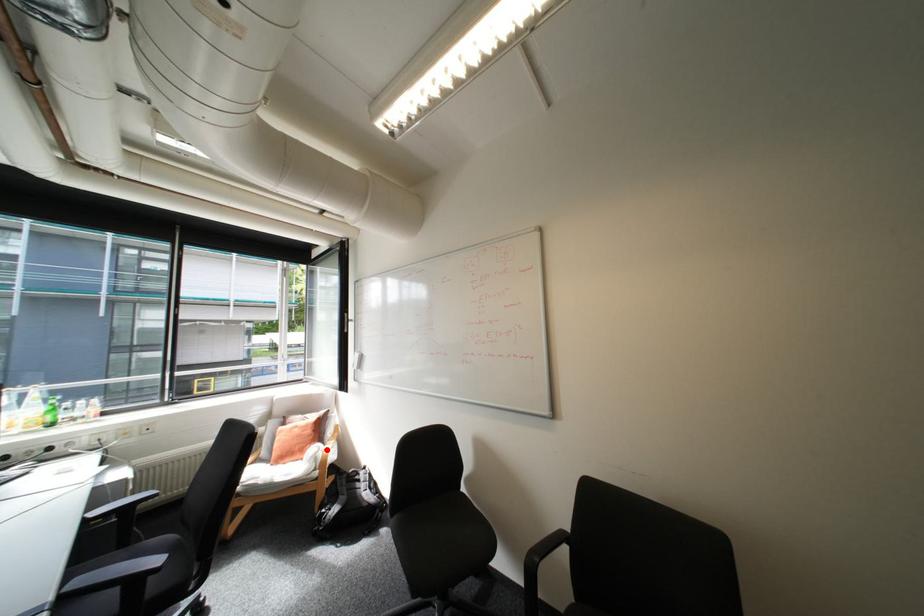
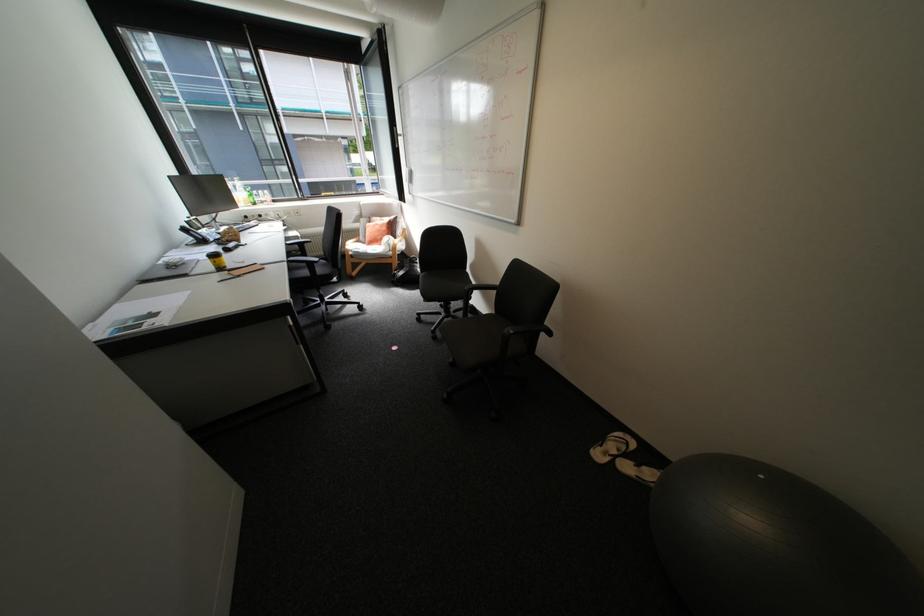
Question: I am providing you with two images of the same scene from different viewpoints. A red point is marked on the first image. At the location where the point appears in image 1, is it still visible in image 2?

Choices:
 (A) Yes
 (B) No

Answer: (A)